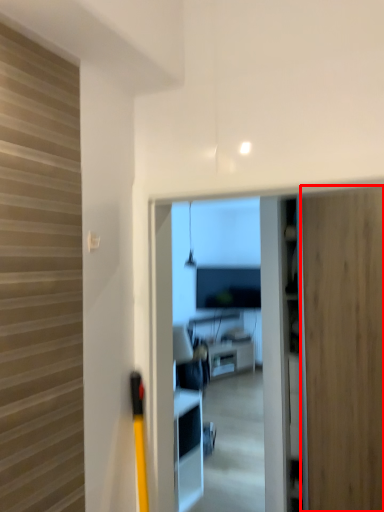
Question: From the image's perspective, considering the relative positions of door (annotated by the red box) and furniture in the image provided, where is door (annotated by the red box) located with respect to the staircase?

Choices:
 (A) above
 (B) below

Answer: (A)